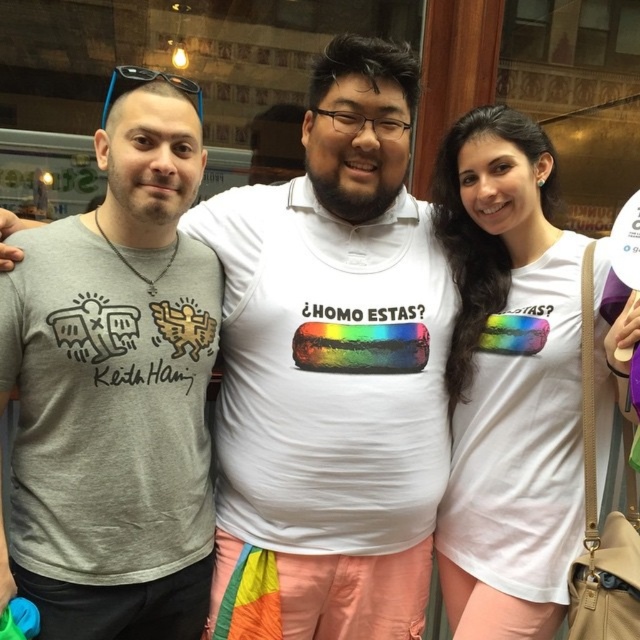
Who is higher up, gray matte t-shirt at left or white cotton t-shirt at center?

gray matte t-shirt at left is above.

Between gray matte t-shirt at left and white cotton t-shirt at center, which one has less height?

gray matte t-shirt at left is shorter.

Is point (177, 84) closer to viewer compared to point (477, 524)?

Yes, it is in front of point (477, 524).

I want to click on gray matte t-shirt at left, so click(x=115, y=388).

Is point (381, 310) closer to viewer compared to point (602, 284)?

That is False.

Does gray cotton t-shirt at center come in front of white cotton t-shirt at center?

No, it is not.

Identify the location of gray cotton t-shirt at center. (333, 368).

From the picture: Who is lower down, gray cotton t-shirt at center or gray matte t-shirt at left?

gray matte t-shirt at left is lower down.

Between point (385, 608) and point (81, 548), which one is positioned behind?

Positioned behind is point (385, 608).

This screenshot has height=640, width=640. I want to click on gray cotton t-shirt at center, so click(333, 368).

Where is `gray cotton t-shirt at center`? This screenshot has height=640, width=640. gray cotton t-shirt at center is located at coordinates (333, 368).